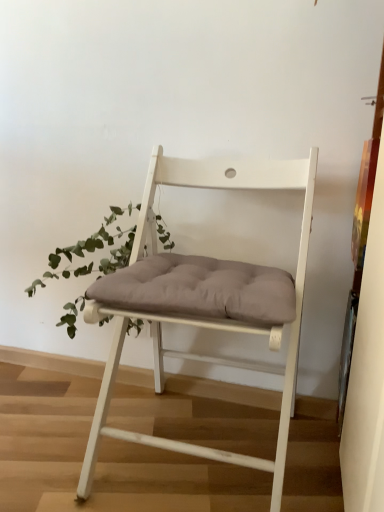
Question: Would you say green leafy plant at left is inside or outside white wood chair at center?

Choices:
 (A) outside
 (B) inside

Answer: (A)

Question: Based on their sizes in the image, would you say green leafy plant at left is bigger or smaller than white wood chair at center?

Choices:
 (A) small
 (B) big

Answer: (A)

Question: In terms of width, does green leafy plant at left look wider or thinner when compared to white wood chair at center?

Choices:
 (A) wide
 (B) thin

Answer: (B)

Question: From their relative heights in the image, would you say white wood chair at center is taller or shorter than green leafy plant at left?

Choices:
 (A) tall
 (B) short

Answer: (A)

Question: In the image, is white wood chair at center on the left side or the right side of green leafy plant at left?

Choices:
 (A) right
 (B) left

Answer: (A)

Question: Is white wood chair at center bigger or smaller than green leafy plant at left?

Choices:
 (A) small
 (B) big

Answer: (B)

Question: Is white wood chair at center in front of or behind green leafy plant at left in the image?

Choices:
 (A) front
 (B) behind

Answer: (A)